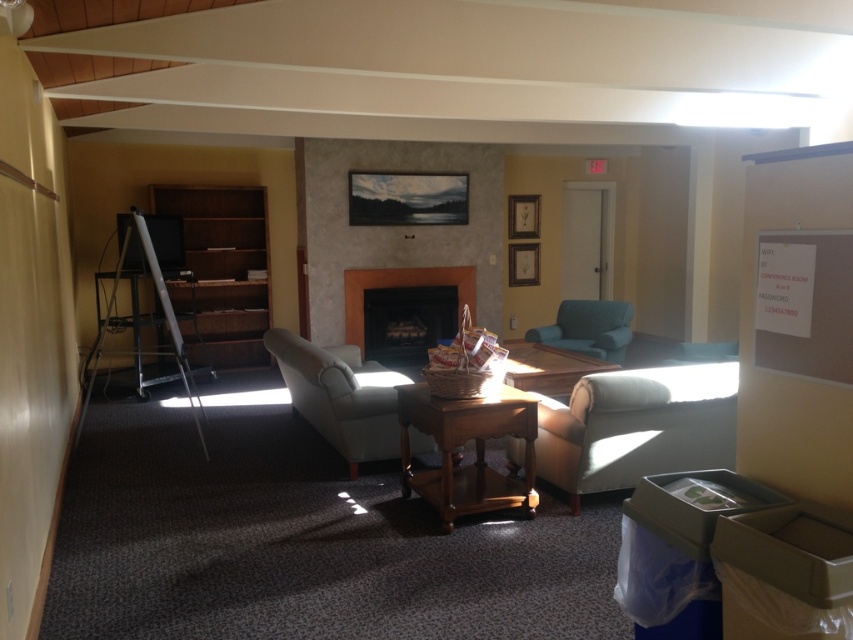
Question: Is mahogany wood coffee table at center to the left of light blue fabric armchair at center from the viewer's perspective?

Choices:
 (A) no
 (B) yes

Answer: (A)

Question: Is mahogany wood coffee table at center smaller than wooden table at center?

Choices:
 (A) no
 (B) yes

Answer: (A)

Question: Which of these objects is positioned farthest from the teal fabric armchair at center?

Choices:
 (A) wooden table at center
 (B) mahogany wood coffee table at center
 (C) matte stone fireplace at center

Answer: (B)

Question: Which of these objects is positioned closest to the matte stone fireplace at center?

Choices:
 (A) teal fabric armchair at center
 (B) wooden bookshelf at left
 (C) mahogany wood coffee table at center

Answer: (B)

Question: Is teal fabric armchair at center thinner than wooden table at center?

Choices:
 (A) yes
 (B) no

Answer: (B)

Question: Among these points, which one is farthest from the camera?

Choices:
 (A) (344, 289)
 (B) (527, 371)
 (C) (242, 301)
 (D) (506, 500)

Answer: (C)